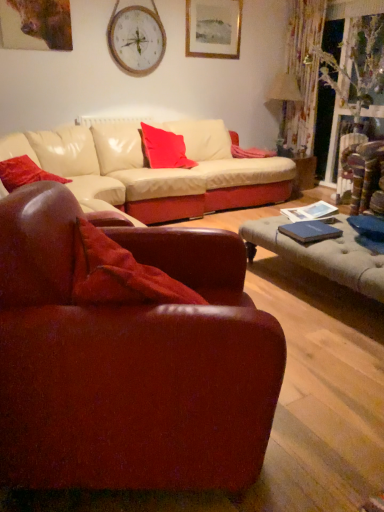
Question: Considering the relative sizes of wooden clock at upper center and leather armchair at lower left in the image provided, is wooden clock at upper center wider than leather armchair at lower left?

Choices:
 (A) yes
 (B) no

Answer: (B)

Question: Is leather armchair at lower left at the back of wooden clock at upper center?

Choices:
 (A) no
 (B) yes

Answer: (A)

Question: Would you consider wooden clock at upper center to be distant from leather armchair at lower left?

Choices:
 (A) no
 (B) yes

Answer: (B)

Question: Is wooden clock at upper center shorter than leather armchair at lower left?

Choices:
 (A) no
 (B) yes

Answer: (B)

Question: From the image's perspective, is wooden clock at upper center under leather armchair at lower left?

Choices:
 (A) no
 (B) yes

Answer: (A)

Question: Looking at their shapes, would you say wooden picture frame at upper center is wider or thinner than blue matte book at lower right?

Choices:
 (A) wide
 (B) thin

Answer: (B)

Question: Is wooden picture frame at upper center spatially inside blue matte book at lower right, or outside of it?

Choices:
 (A) outside
 (B) inside

Answer: (A)

Question: From the image's perspective, relative to blue matte book at lower right, is wooden picture frame at upper center above or below?

Choices:
 (A) below
 (B) above

Answer: (B)

Question: Considering the positions of point (211, 28) and point (304, 231), is point (211, 28) closer or farther from the camera than point (304, 231)?

Choices:
 (A) closer
 (B) farther

Answer: (B)

Question: From the image's perspective, relative to wooden picture frame at upper center, is blue matte book at lower right above or below?

Choices:
 (A) above
 (B) below

Answer: (B)

Question: Would you say blue matte book at lower right is to the left or to the right of wooden picture frame at upper center in the picture?

Choices:
 (A) right
 (B) left

Answer: (A)

Question: Is blue matte book at lower right taller or shorter than wooden picture frame at upper center?

Choices:
 (A) short
 (B) tall

Answer: (A)

Question: Is blue matte book at lower right in front of or behind wooden picture frame at upper center in the image?

Choices:
 (A) behind
 (B) front

Answer: (B)

Question: Is matte red pillow at left, the 1th pillow when ordered from left to right, situated inside wooden clock at upper center or outside?

Choices:
 (A) inside
 (B) outside

Answer: (B)

Question: Considering the positions of matte red pillow at left, which is the 1th pillow from bottom to top, and wooden clock at upper center in the image, is matte red pillow at left, which is the 1th pillow from bottom to top, bigger or smaller than wooden clock at upper center?

Choices:
 (A) big
 (B) small

Answer: (A)